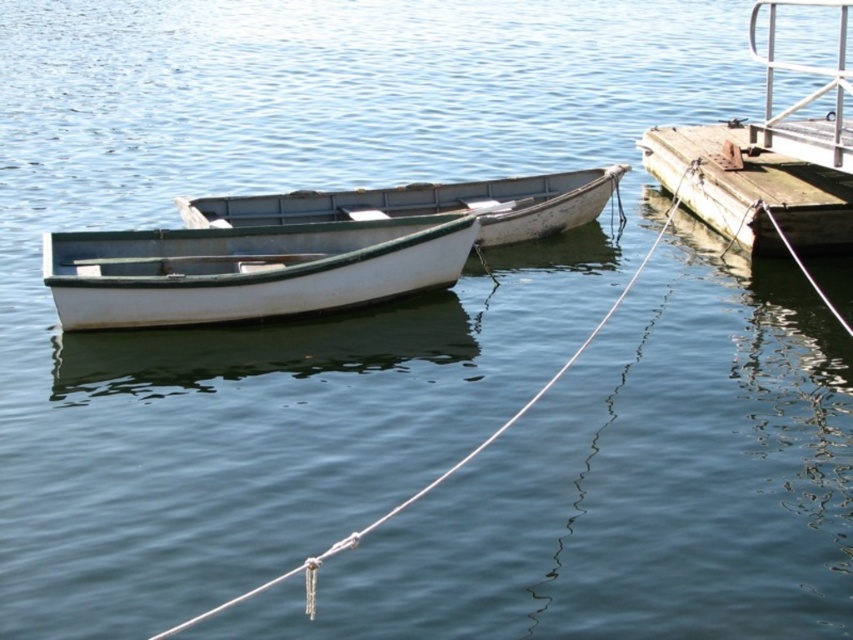
Can you confirm if white matte boat at left is positioned to the right of rusty wood dock at right?

Incorrect, white matte boat at left is not on the right side of rusty wood dock at right.

Between point (128, 324) and point (833, 214), which one is positioned in front?

Positioned in front is point (128, 324).

Where is `white matte boat at left`? Image resolution: width=853 pixels, height=640 pixels. white matte boat at left is located at coordinates (247, 269).

In the scene shown: Measure the distance between white matte boat at left and white rope at center.

They are 3.31 meters apart.

Where is `white matte boat at left`? The width and height of the screenshot is (853, 640). white matte boat at left is located at coordinates (247, 269).

Where is `white matte boat at left`? The width and height of the screenshot is (853, 640). white matte boat at left is located at coordinates (247, 269).

Is white painted wood boat at center positioned at the back of white rope at center?

Yes.

Can you confirm if white painted wood boat at center is thinner than white rope at center?

Incorrect, white painted wood boat at center's width is not less than white rope at center's.

Between point (178, 211) and point (695, 163), which one is positioned behind?

The point (695, 163) is more distant.

Where is `white painted wood boat at center`? The image size is (853, 640). white painted wood boat at center is located at coordinates (427, 204).